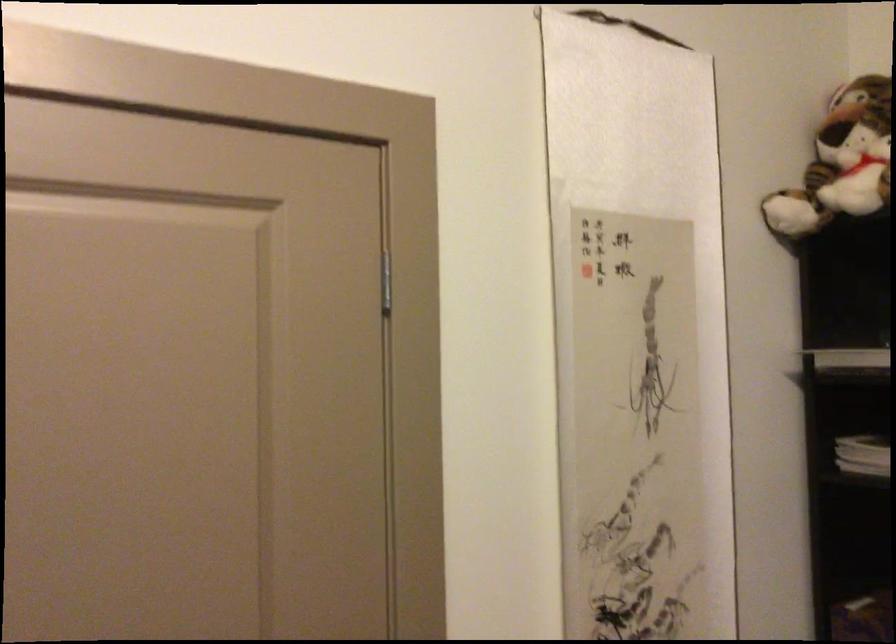
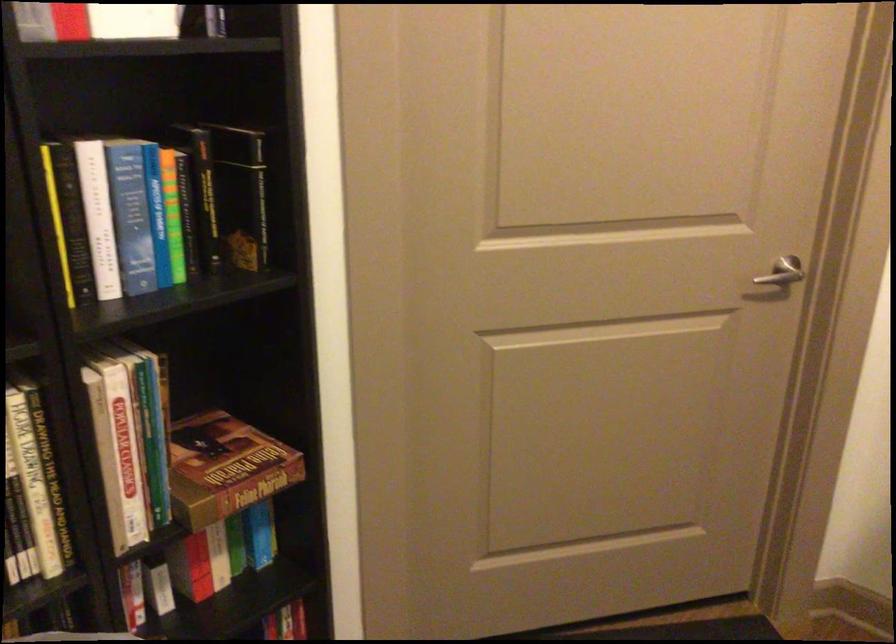
The images are taken continuously from a first-person perspective. In which direction is your viewpoint rotating?

The camera's rotation is toward right-down.